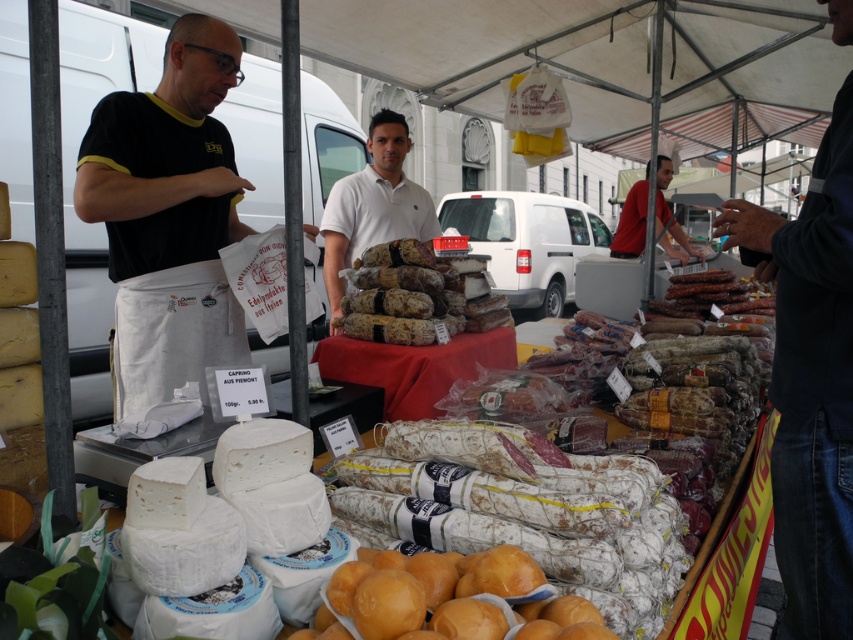
How distant is brown textured salami at center from red cotton shirt at upper right?

2.67 meters

Between brown textured salami at center and red cotton shirt at upper right, which one is positioned higher?

Positioned higher is red cotton shirt at upper right.

Is point (407, 280) more distant than point (668, 180)?

That is False.

Where is `brown textured salami at center`? The width and height of the screenshot is (853, 640). brown textured salami at center is located at coordinates (419, 296).

Measure the distance between brown textured salami at center and white cotton shirt at center.

A distance of 24.85 inches exists between brown textured salami at center and white cotton shirt at center.

Can you confirm if brown textured salami at center is positioned above white cotton shirt at center?

No, brown textured salami at center is not above white cotton shirt at center.

This screenshot has height=640, width=853. I want to click on brown textured salami at center, so click(419, 296).

Between white cotton shirt at center and red cotton shirt at upper right, which one has more height?

white cotton shirt at center

Does white cotton shirt at center have a lesser height compared to red cotton shirt at upper right?

Incorrect, white cotton shirt at center's height does not fall short of red cotton shirt at upper right's.

Between point (378, 227) and point (624, 230), which one is positioned behind?

Positioned behind is point (624, 230).

Find the location of a particular element. white cotton shirt at center is located at coordinates (373, 205).